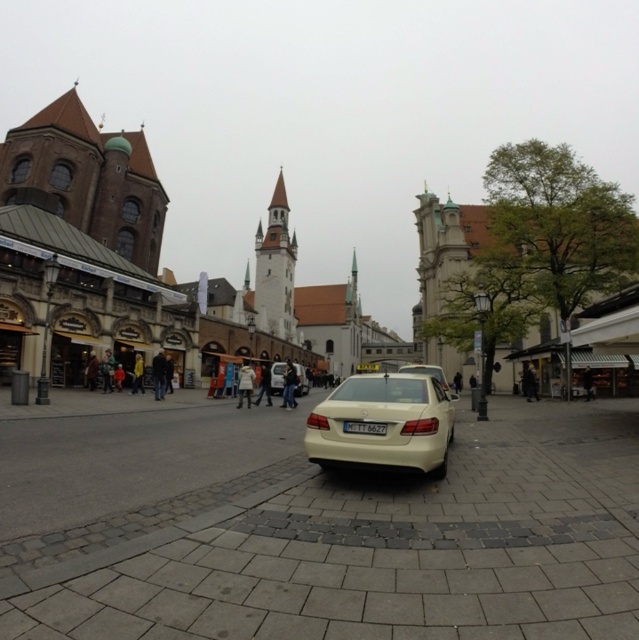
You are a photographer standing at the camera position in the scene. You want to capture a photo of the point at coordinates point (6, 288). However, there is a cream colored sedan parked on the road. Will the sedan block your view of the point?

The point point (6, 288) is 58.96 meters away from the camera. Since the cream colored sedan is parked on the road, it might block the view depending on its position. However, the distance is quite far, so it is possible that the sedan does not obstruct the line of sight to the point.

You are a tourist standing at the intersection in the image. You see two points marked on the ground. The first point is at coordinates point (281,292) and the second point is at point (142,371). Which point is closer to you?

Point (142,371) is closer to you because it is in front of point (281,292).

You are standing in the middle of the street looking towards the cream colored sedan parked on the road. There are two points marked on the ground in front of you. One is at coordinate point (279, 394) and the other is at point (417, 365). Which point is closer to you?

Point (279, 394) is closer to you because it is further to the camera than point (417, 365).